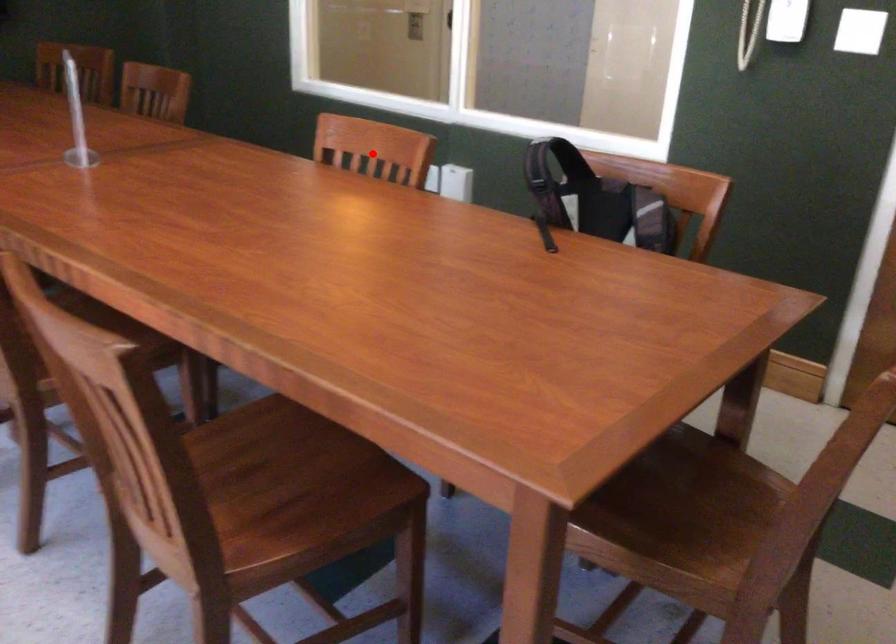
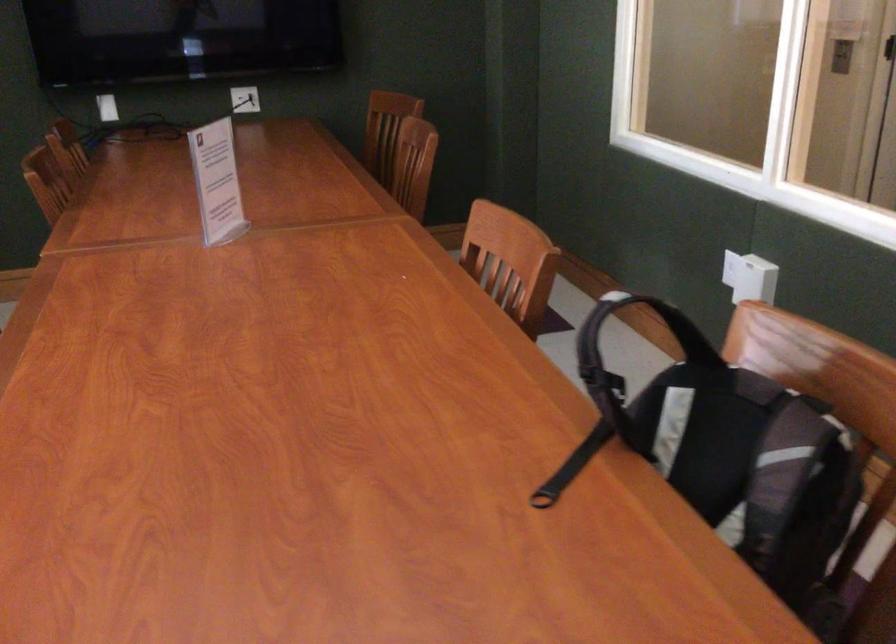
Question: I am providing you with two images of the same scene from different viewpoints. Image1 has a red point marked. In image2, the corresponding 3D location appears at what relative position? Reply with the corresponding letter.

Choices:
 (A) Closer
 (B) Farther

Answer: (A)